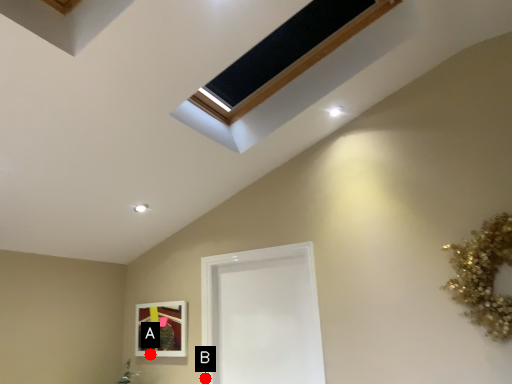
Question: Two points are circled on the image, labeled by A and B beside each circle. Which point is further to the camera?

Choices:
 (A) A is further
 (B) B is further

Answer: (A)